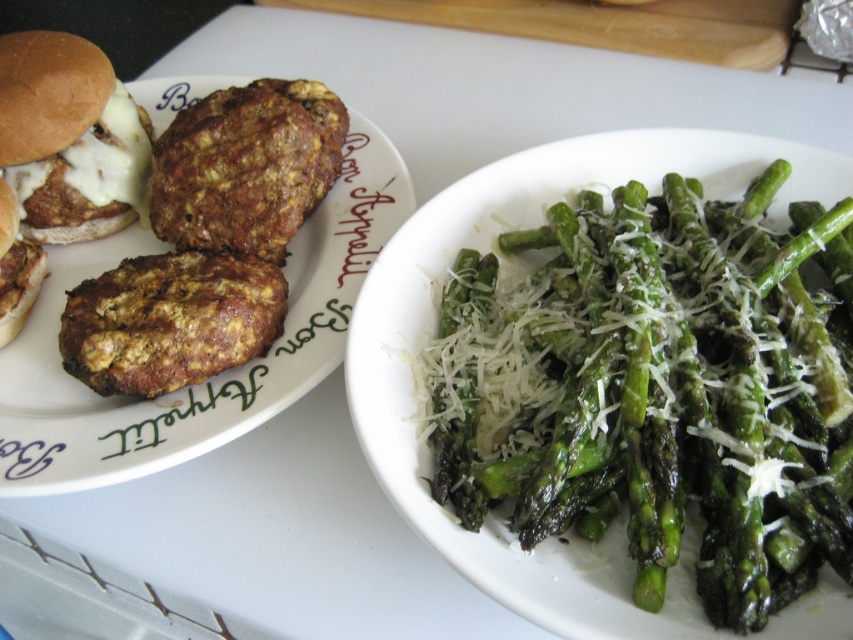
Looking at this image, between green asparagus at right and matte brown patty at left, which one is positioned higher?

matte brown patty at left is higher up.

Can you confirm if green asparagus at right is bigger than matte brown patty at left?

Yes.

Does point (686, 419) lie in front of point (7, 339)?

Yes, it is in front of point (7, 339).

You are a GUI agent. You are given a task and a screenshot of the screen. Output one action in this format:
    pyautogui.click(x=<x>, y=<y>)
    Task: Click on the green asparagus at right
    
    Given the screenshot: What is the action you would take?
    pyautogui.click(x=650, y=392)

Between brown crumbly meatballs at left and white melted cheese on meat patty at upper left, which one is positioned lower?

brown crumbly meatballs at left

Is brown crumbly meatballs at left positioned behind white melted cheese on meat patty at upper left?

That is False.

Which is behind, point (74, 410) or point (24, 109)?

The point (24, 109) is behind.

Where is `brown crumbly meatballs at left`? brown crumbly meatballs at left is located at coordinates (207, 378).

Between brown crumbly meat at upper left and matte brown patty at left, which one is positioned lower?

→ matte brown patty at left is lower down.

Looking at this image, is brown crumbly meat at upper left above matte brown patty at left?

Correct, brown crumbly meat at upper left is located above matte brown patty at left.

Which is in front, point (227, 106) or point (18, 308)?

Point (18, 308)

I want to click on brown crumbly meat at upper left, so click(x=247, y=166).